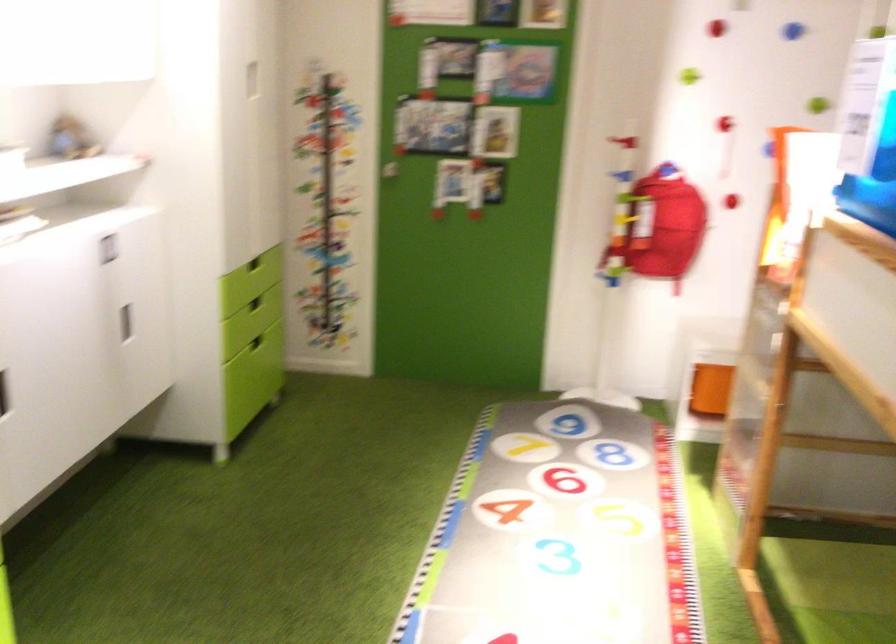
Where is `blue climbing hold`? The width and height of the screenshot is (896, 644). blue climbing hold is located at coordinates (793, 31).